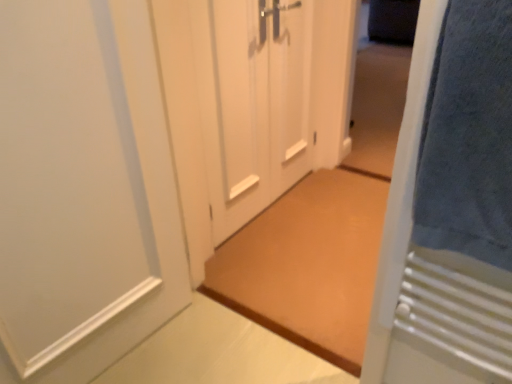
Question: In the image, is blue soft towel at right on the left side or the right side of white matte door at left, which appears as the fourth door when viewed from the right?

Choices:
 (A) left
 (B) right

Answer: (B)

Question: In terms of height, does blue soft towel at right look taller or shorter compared to white matte door at left, which appears as the fourth door when viewed from the right?

Choices:
 (A) tall
 (B) short

Answer: (B)

Question: Estimate the real-world distances between objects in this image. Which object is farther from the white matte door at left, the first door when ordered from left to right?

Choices:
 (A) blue soft towel at right
 (B) brown matte doormat at center
 (C) white matte door at center, the second door in the left-to-right sequence
 (D) blue towel at right, which is counted as the 4th door, starting from the left
 (E) white matte door at center, acting as the 2th door starting from the right

Answer: (E)

Question: Estimate the real-world distances between objects in this image. Which object is closer to the brown matte doormat at center?

Choices:
 (A) blue soft towel at right
 (B) blue towel at right, the first door in the right-to-left sequence
 (C) white matte door at center, the second door in the left-to-right sequence
 (D) white matte door at center, placed as the 3th door when sorted from left to right
 (E) white matte door at left, the first door when ordered from left to right

Answer: (C)